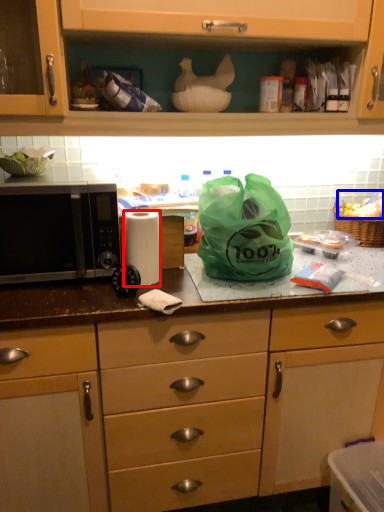
Question: Which object is closer to the camera taking this photo, paper towel (highlighted by a red box) or food (highlighted by a blue box)?

Choices:
 (A) paper towel
 (B) food

Answer: (A)